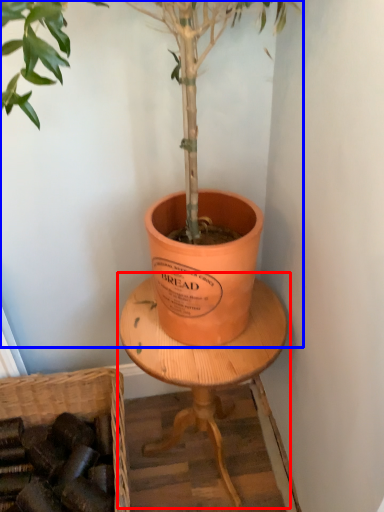
Question: Which object is further to the camera taking this photo, round table (highlighted by a red box) or houseplant (highlighted by a blue box)?

Choices:
 (A) round table
 (B) houseplant

Answer: (A)